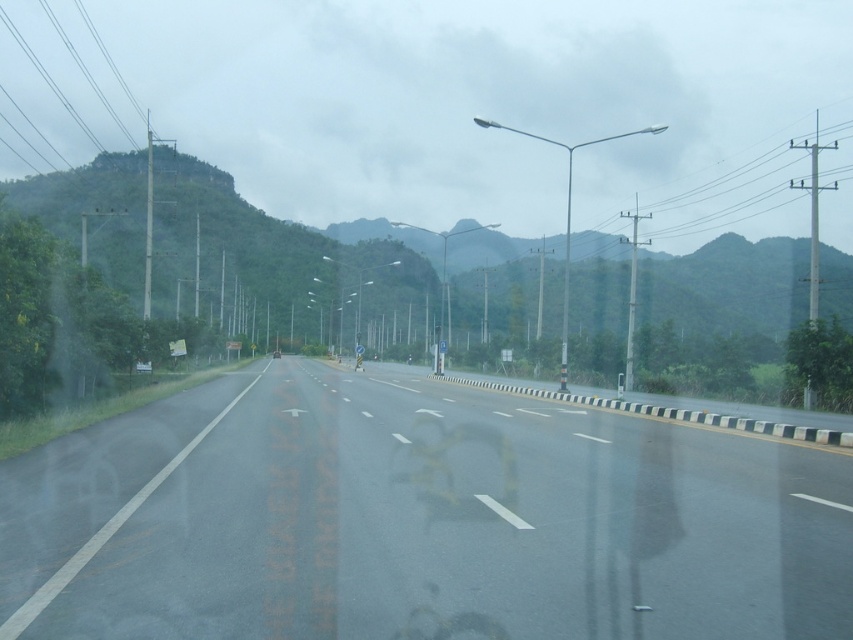
You are a delivery driver who needs to stop your truck on the asphalt road at center. The truck requires 90 meters of space to safely come to a stop. Based on the scene, can you safely stop the truck before reaching the green textured mountain at left?

The distance between the asphalt road at center and the green textured mountain at left is 82.80 meters. Since the truck requires 90 meters to stop, it is not enough distance. Therefore, you cannot safely stop the truck before reaching the green textured mountain at left.